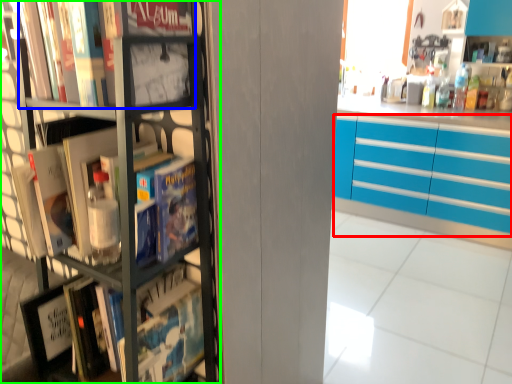
Question: Estimate the real-world distances between objects in this image. Which object is farther from cabinetry (highlighted by a red box), book (highlighted by a blue box) or bookcase (highlighted by a green box)?

Choices:
 (A) book
 (B) bookcase

Answer: (A)